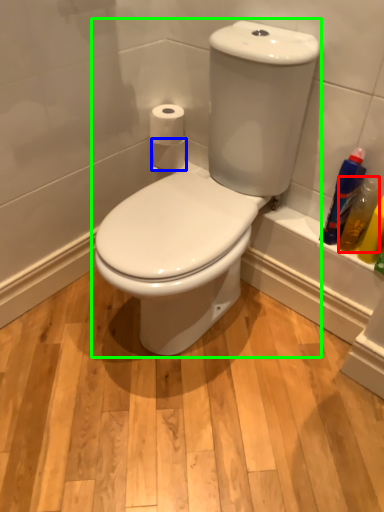
Question: Considering the real-world distances, which object is closest to cleaning product (highlighted by a red box)? toilet paper (highlighted by a blue box) or toilet (highlighted by a green box).

Choices:
 (A) toilet paper
 (B) toilet

Answer: (B)